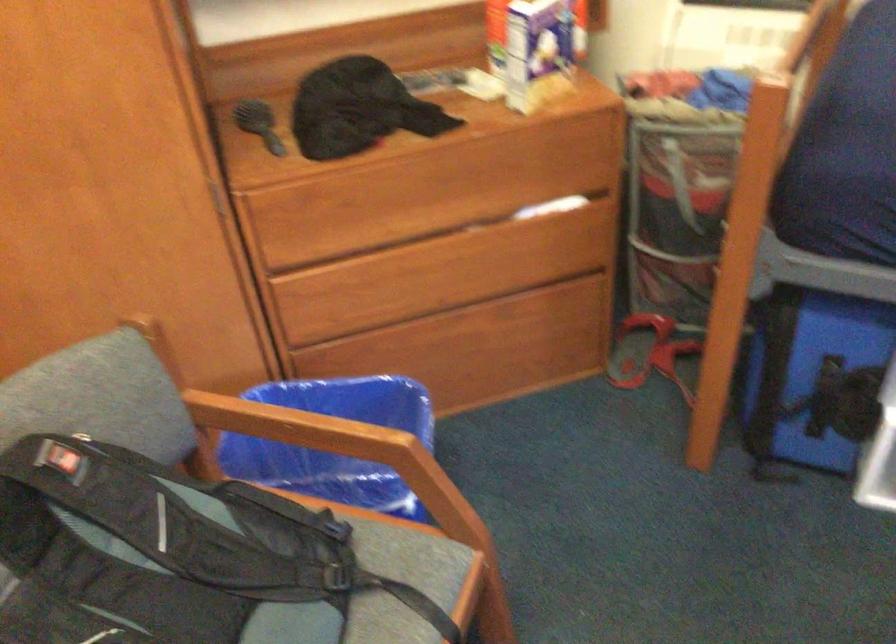
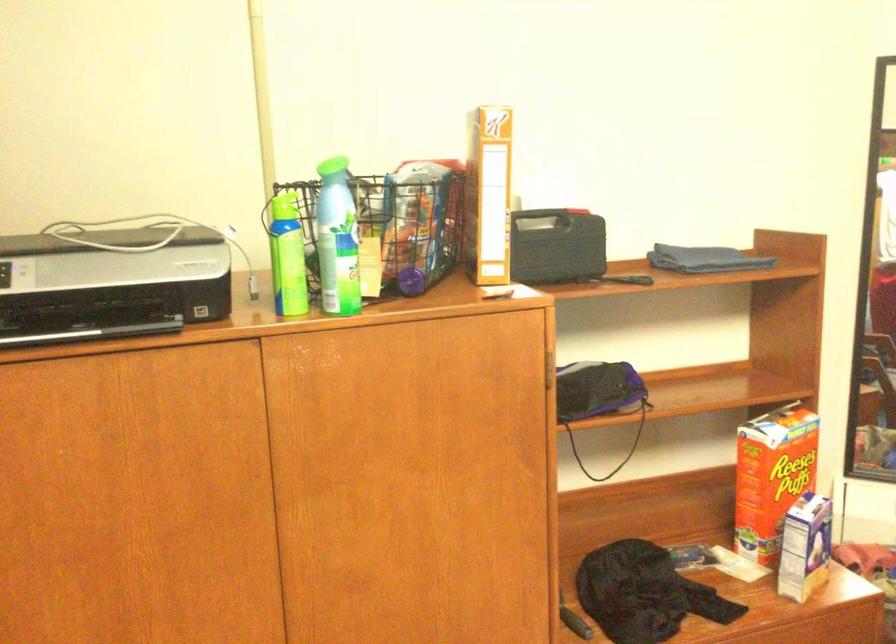
Question: Based on the continuous images, in which direction is the camera rotating? Reply with the corresponding letter.

Choices:
 (A) Left
 (B) Right
 (C) Up
 (D) Down

Answer: (C)